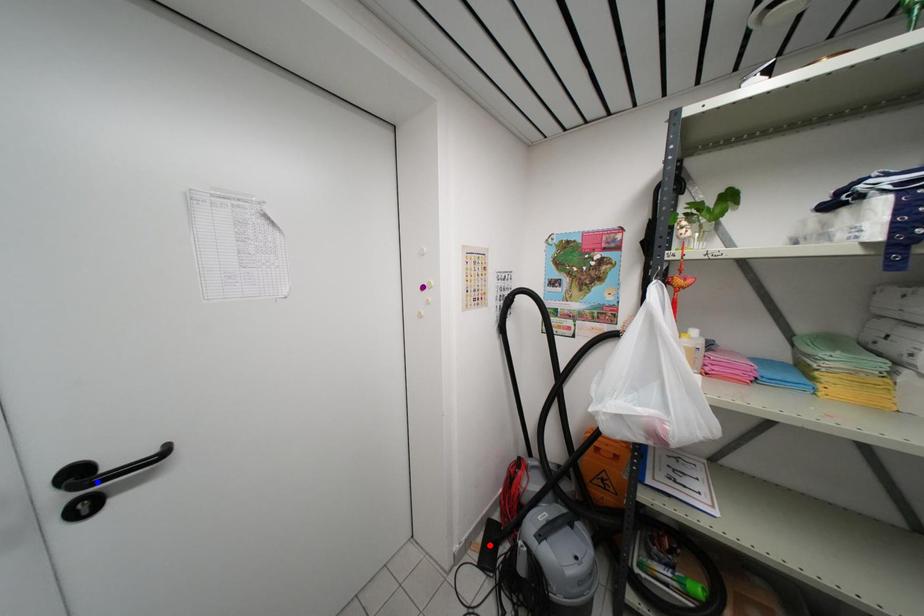
Order these from farthest to nearest:
blue point | red point | purple point

1. red point
2. purple point
3. blue point